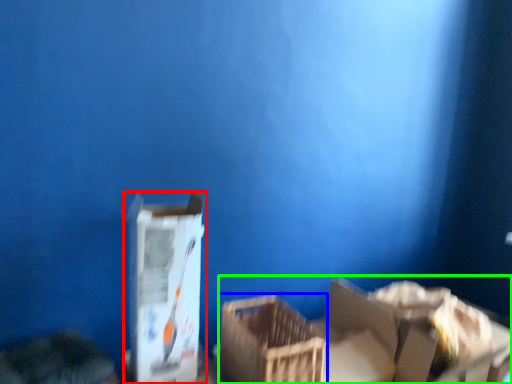
Question: Which is farther away from box (highlighted by a red box)? crate (highlighted by a blue box) or storage box (highlighted by a green box)?

Choices:
 (A) crate
 (B) storage box

Answer: (B)